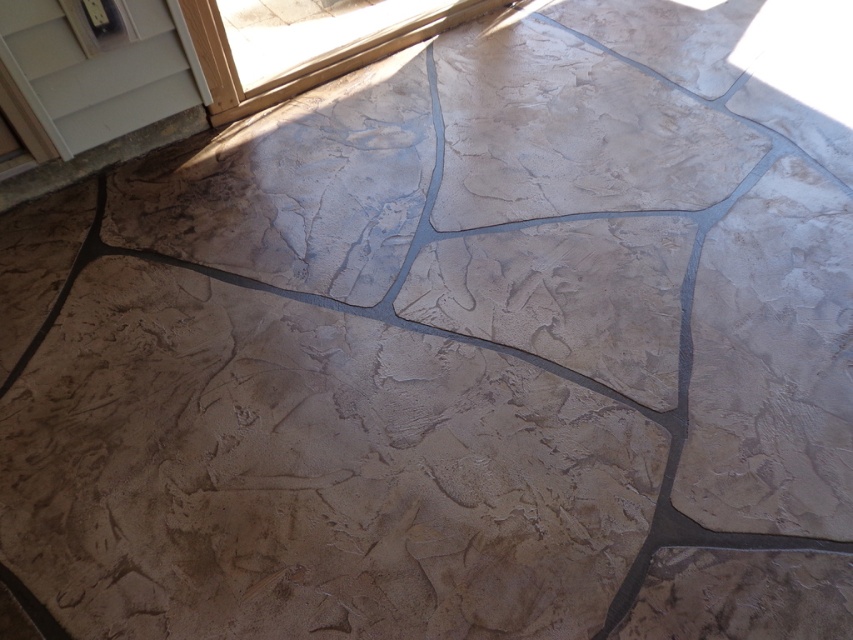
Question: Which of the following is the closest to the observer?

Choices:
 (A) (247, 100)
 (B) (9, 58)

Answer: (B)

Question: Which object appears farthest from the camera in this image?

Choices:
 (A) white painted wood screen door at upper left
 (B) transparent glass door at upper left

Answer: (B)

Question: Does white painted wood screen door at upper left come behind transparent glass door at upper left?

Choices:
 (A) no
 (B) yes

Answer: (A)

Question: Does white painted wood screen door at upper left appear on the right side of transparent glass door at upper left?

Choices:
 (A) yes
 (B) no

Answer: (B)

Question: Which of the following is the farthest from the observer?

Choices:
 (A) transparent glass door at upper left
 (B) white painted wood screen door at upper left

Answer: (A)

Question: Is white painted wood screen door at upper left to the right of transparent glass door at upper left from the viewer's perspective?

Choices:
 (A) yes
 (B) no

Answer: (B)